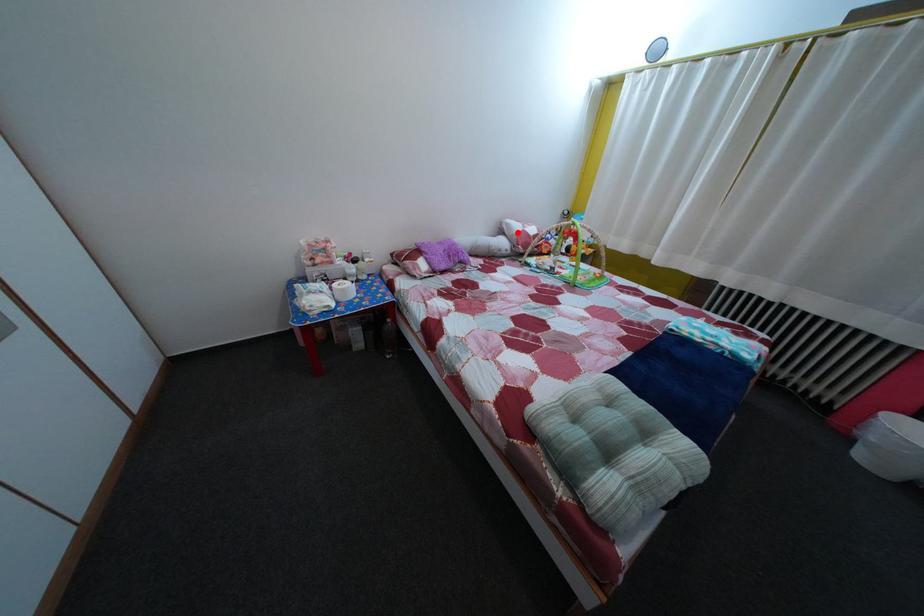
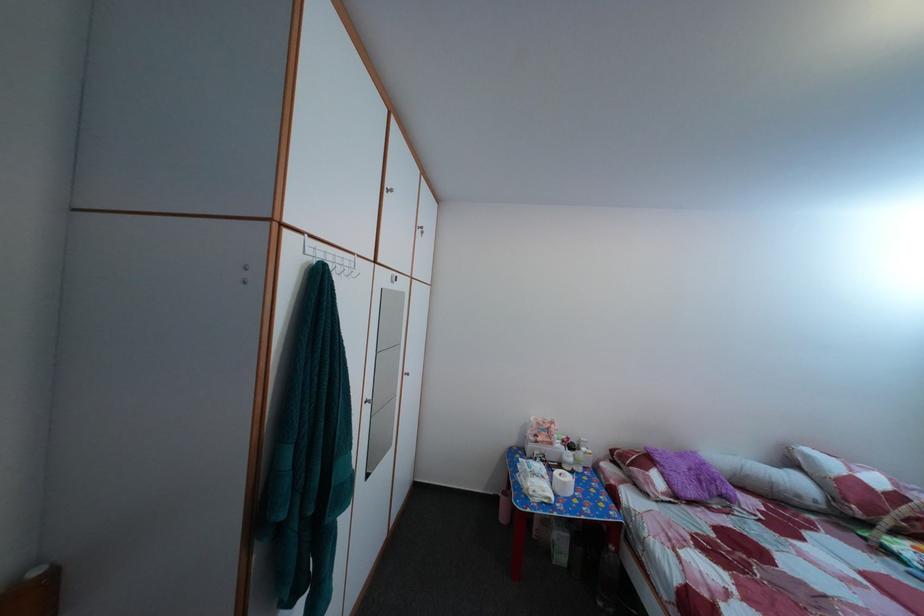
In the second image, find the point that corresponds to the highlighted location in the first image.

(817, 464)